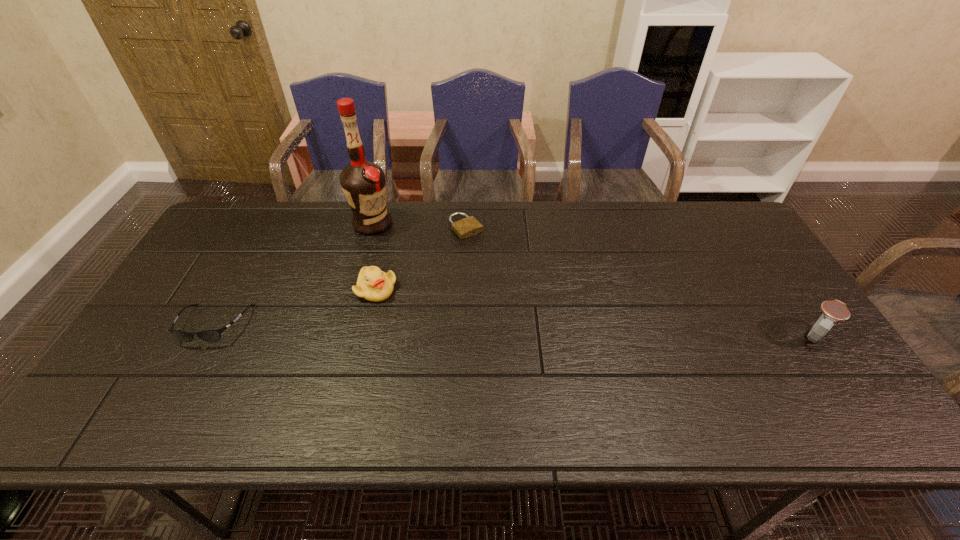
Where is `the leftmost object`? The height and width of the screenshot is (540, 960). the leftmost object is located at coordinates (213, 335).

Where is `sunglasses`? sunglasses is located at coordinates (213, 335).

Find the location of a particular element. The height and width of the screenshot is (540, 960). the rightmost object is located at coordinates (834, 311).

The height and width of the screenshot is (540, 960). I want to click on the second tallest object, so click(x=834, y=311).

I want to click on the second object from right to left, so click(469, 226).

Identify the location of the shortest object. (469, 226).

This screenshot has width=960, height=540. I want to click on liquor, so (363, 183).

Image resolution: width=960 pixels, height=540 pixels. In order to click on duckling in this screenshot , I will do click(x=374, y=285).

Where is `the third nearest object`? The image size is (960, 540). the third nearest object is located at coordinates tap(374, 285).

Identify the location of vacant point located on the front-facing side of the second shortest object. The width and height of the screenshot is (960, 540). (185, 378).